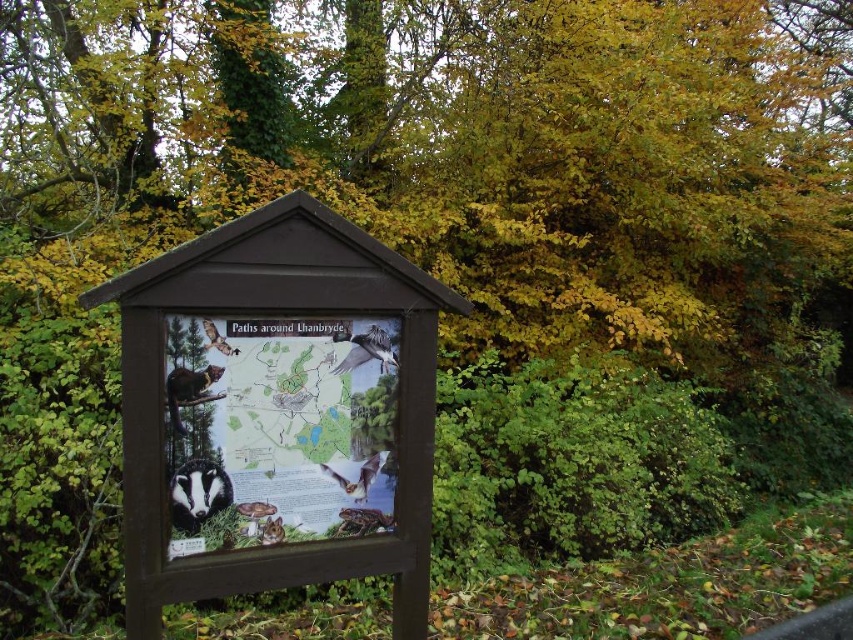
Question: Is black fur badger at center further to camera compared to white glossy bird at center?

Choices:
 (A) no
 (B) yes

Answer: (A)

Question: Does wooden signboard at center appear under brown furry bat at center?

Choices:
 (A) yes
 (B) no

Answer: (B)

Question: Estimate the real-world distances between objects in this image. Which object is closer to the brown furry bat at lower center?

Choices:
 (A) matte paper map at center
 (B) wooden signboard at center
 (C) black fur badger at center

Answer: (A)

Question: Which object is positioned farthest from the brown furry bat at lower center?

Choices:
 (A) matte paper map at center
 (B) brown fur badger at center
 (C) wooden signboard at center
 (D) white glossy bird at center

Answer: (B)

Question: Does white glossy bird at center have a larger size compared to brown fur badger at center?

Choices:
 (A) yes
 (B) no

Answer: (A)

Question: Among these points, which one is farthest from the camera?

Choices:
 (A) (340, 536)
 (B) (248, 365)
 (C) (361, 465)
 (D) (224, 340)

Answer: (C)